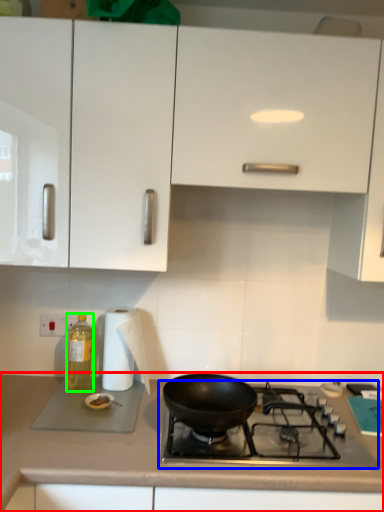
Question: Estimate the real-world distances between objects in this image. Which object is farther from countertop (highlighted by a red box), gas stove (highlighted by a blue box) or bottle (highlighted by a green box)?

Choices:
 (A) gas stove
 (B) bottle

Answer: (B)